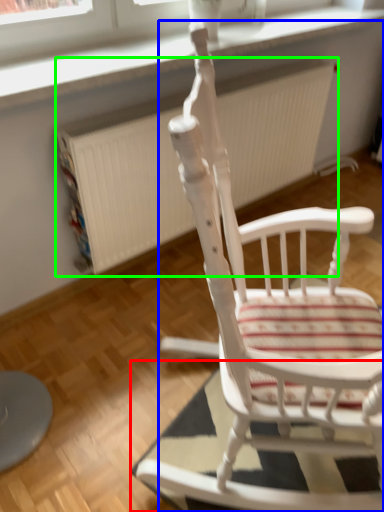
Question: Considering the real-world distances, which object is farthest from mat (highlighted by a red box)? chair (highlighted by a blue box) or radiator (highlighted by a green box)?

Choices:
 (A) chair
 (B) radiator

Answer: (B)